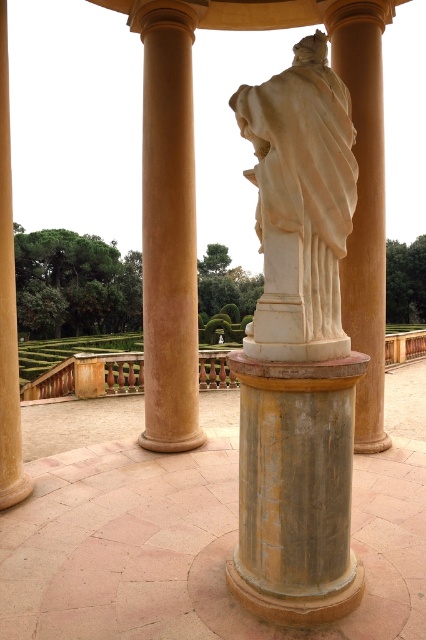
You are an architect designing a new garden structure. You observe the image and notice two columns at the center. Which column, the gray stone column at center or the smooth beige column at center, would allow for a wider base if you were to replicate them in your design?

The smooth beige column at center has a greater width than the gray stone column at center, so replicating the smooth beige column at center would allow for a wider base.

Based on the photo, you are an architect designing a new garden layout and need to place a 2.5 meter wide decorative fountain between the smooth beige column at center and the white marble column at center. Can the fountain fit between them?

The smooth beige column at center is 2.21 meters away from the white marble column at center. Since the distance between them is less than the fountain width of 2.5 meters, the fountain cannot fit between them.